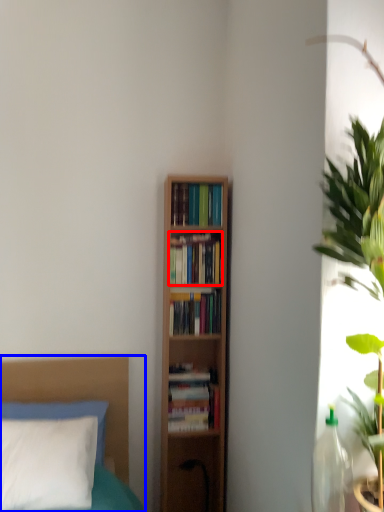
Question: Which of the following is the farthest to the observer, book (highlighted by a red box) or bed (highlighted by a blue box)?

Choices:
 (A) book
 (B) bed

Answer: (A)